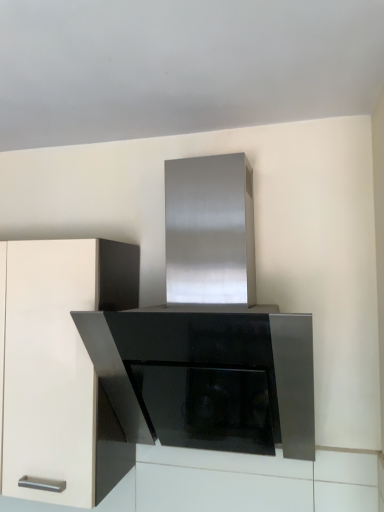
Question: From a real-world perspective, relative to matte white cabinet at left, is stainless steel range hood at center vertically above or below?

Choices:
 (A) below
 (B) above

Answer: (B)

Question: From the image's perspective, relative to matte white cabinet at left, is stainless steel range hood at center above or below?

Choices:
 (A) below
 (B) above

Answer: (B)

Question: In the image, is stainless steel range hood at center on the left side or the right side of matte white cabinet at left?

Choices:
 (A) right
 (B) left

Answer: (A)

Question: Is point (11, 340) closer or farther from the camera than point (185, 248)?

Choices:
 (A) farther
 (B) closer

Answer: (B)

Question: In the image, is matte white cabinet at left on the left side or the right side of stainless steel range hood at center?

Choices:
 (A) left
 (B) right

Answer: (A)

Question: From the image's perspective, is matte white cabinet at left located above or below stainless steel range hood at center?

Choices:
 (A) above
 (B) below

Answer: (B)

Question: Is matte white cabinet at left wider or thinner than stainless steel range hood at center?

Choices:
 (A) wide
 (B) thin

Answer: (B)